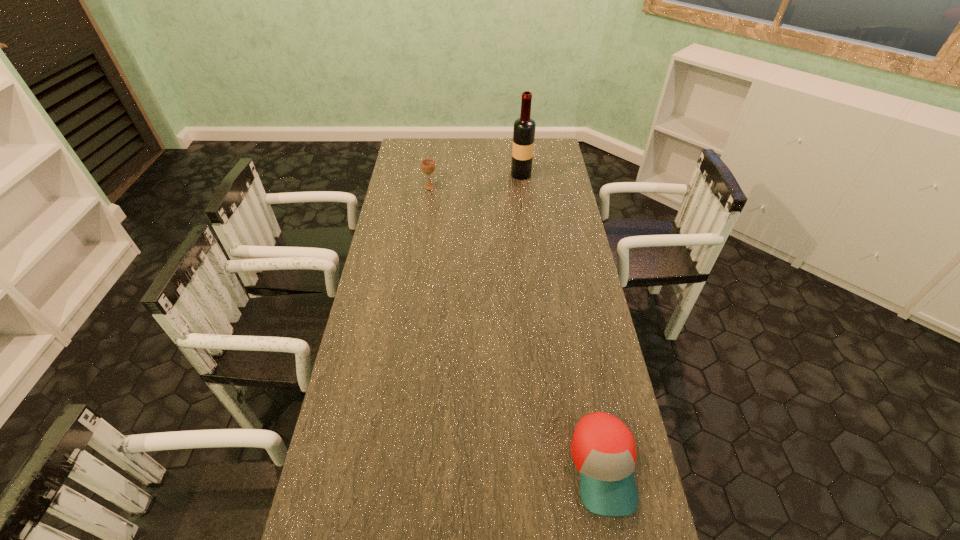
The height and width of the screenshot is (540, 960). What are the coordinates of `baseball cap that is at the right edge` in the screenshot? It's located at (603, 449).

Find the location of a particular element. vacant space at the far edge of the desktop is located at coordinates (470, 146).

The width and height of the screenshot is (960, 540). In order to click on vacant area at the left edge in this screenshot , I will do `click(414, 179)`.

In the image, there is a desktop. Where is `vacant space at the right edge`? This screenshot has height=540, width=960. vacant space at the right edge is located at coordinates (558, 221).

At what (x,y) coordinates should I click in order to perform the action: click on free space at the far left corner of the desktop. Please return your answer as a coordinate pair (x, y). The width and height of the screenshot is (960, 540). Looking at the image, I should click on (427, 143).

The image size is (960, 540). Find the location of `free space between the nearest object and the chalice`. free space between the nearest object and the chalice is located at coordinates (516, 327).

This screenshot has height=540, width=960. I want to click on empty space that is in between the shortest object and the second farthest object, so pyautogui.click(x=516, y=327).

Where is `vacant region between the shortest object and the leftmost object`? This screenshot has width=960, height=540. vacant region between the shortest object and the leftmost object is located at coordinates (516, 327).

Find the location of a particular element. The image size is (960, 540). empty space that is in between the shortest object and the wine bottle is located at coordinates (563, 321).

In order to click on free spot between the farthest object and the second shortest object in this screenshot , I will do `click(475, 181)`.